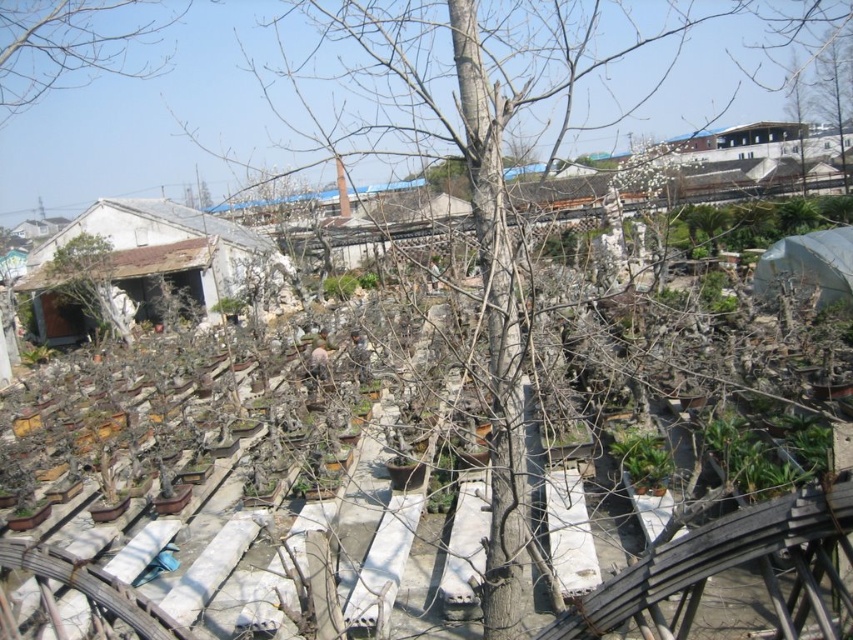
Question: Does bare branches at upper left have a larger size compared to brown wooden tree at center?

Choices:
 (A) no
 (B) yes

Answer: (B)

Question: Does bare branches at upper left have a smaller size compared to brown wooden tree at center?

Choices:
 (A) yes
 (B) no

Answer: (B)

Question: Which point is farther from the camera taking this photo?

Choices:
 (A) (102, 250)
 (B) (36, 67)

Answer: (B)

Question: Is bare branches at upper left smaller than brown wooden tree at center?

Choices:
 (A) yes
 (B) no

Answer: (B)